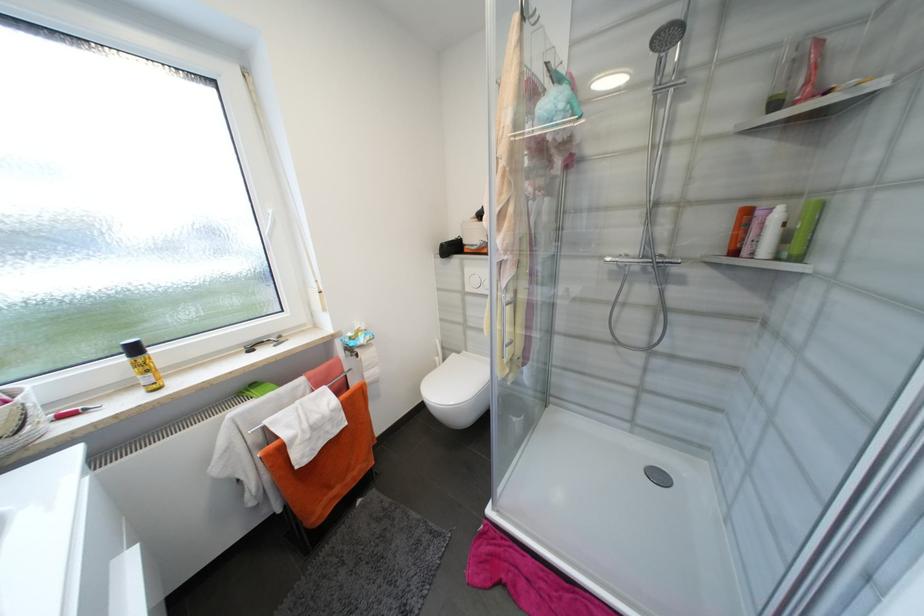
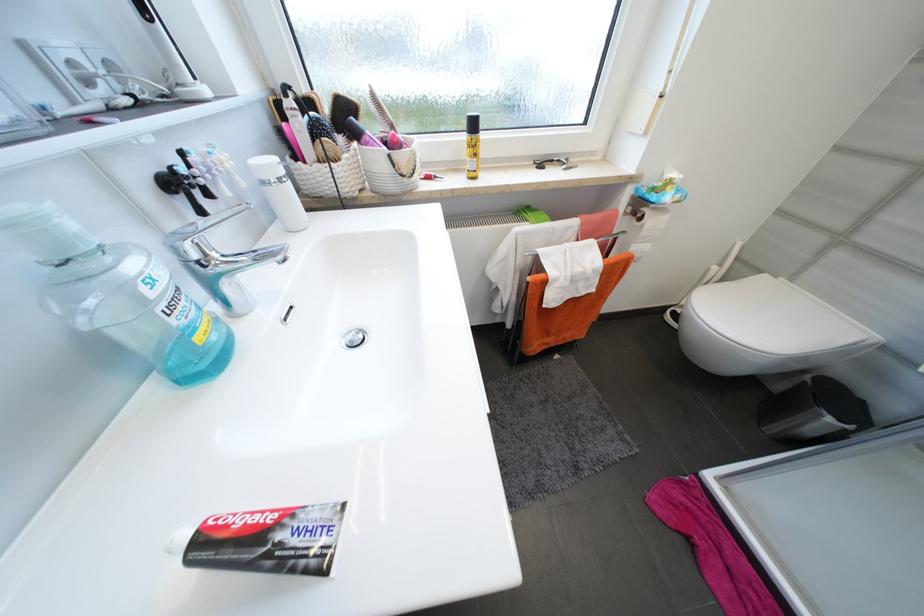
Find the pixel in the second image that matches point (459, 355) in the first image.

(771, 277)